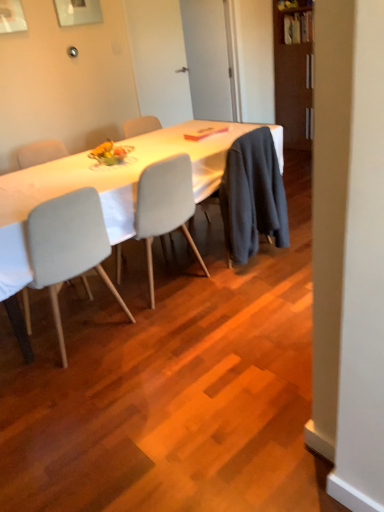
Locate an element on the screen. The height and width of the screenshot is (512, 384). free space underneath dark gray fabric robe at center (from a real-world perspective) is located at coordinates (261, 251).